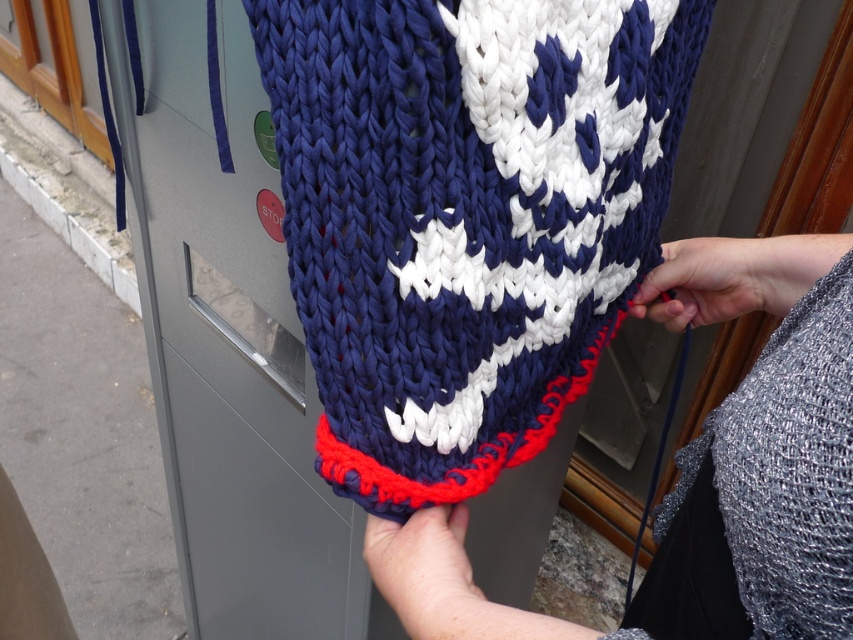
Question: Can you confirm if white knitted scarf at center is positioned to the right of smooth gray hand at center right?

Choices:
 (A) no
 (B) yes

Answer: (B)

Question: Is smooth skin hand at lower center behind smooth gray hand at center right?

Choices:
 (A) no
 (B) yes

Answer: (A)

Question: Can you confirm if white knitted scarf at center is positioned to the right of smooth gray hand at center right?

Choices:
 (A) yes
 (B) no

Answer: (A)

Question: Among these objects, which one is farthest from the camera?

Choices:
 (A) smooth skin hand at lower center
 (B) white knitted scarf at center

Answer: (B)

Question: Among these objects, which one is nearest to the camera?

Choices:
 (A) white knitted scarf at center
 (B) smooth gray hand at center right

Answer: (A)

Question: Which object is positioned farthest from the smooth skin hand at lower center?

Choices:
 (A) white knitted scarf at center
 (B) smooth gray hand at center right

Answer: (A)